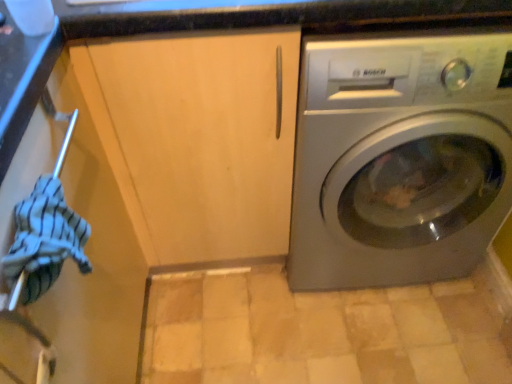
Question: Can you confirm if striped cotton towel at left is wider than satin silver washing machine at right?

Choices:
 (A) no
 (B) yes

Answer: (A)

Question: From a real-world perspective, is striped cotton towel at left on satin silver washing machine at right?

Choices:
 (A) yes
 (B) no

Answer: (A)

Question: Can you confirm if striped cotton towel at left is taller than satin silver washing machine at right?

Choices:
 (A) no
 (B) yes

Answer: (A)

Question: From the image's perspective, is striped cotton towel at left located beneath satin silver washing machine at right?

Choices:
 (A) no
 (B) yes

Answer: (B)

Question: From a real-world perspective, is striped cotton towel at left located beneath satin silver washing machine at right?

Choices:
 (A) no
 (B) yes

Answer: (A)

Question: Considering their positions, is satin silver washing machine at right located in front of or behind matte wood cabinet at center?

Choices:
 (A) behind
 (B) front

Answer: (A)

Question: Is satin silver washing machine at right wider or thinner than matte wood cabinet at center?

Choices:
 (A) wide
 (B) thin

Answer: (A)

Question: From their relative heights in the image, would you say satin silver washing machine at right is taller or shorter than matte wood cabinet at center?

Choices:
 (A) short
 (B) tall

Answer: (A)

Question: From the image's perspective, is satin silver washing machine at right positioned above or below matte wood cabinet at center?

Choices:
 (A) below
 (B) above

Answer: (B)

Question: From the image's perspective, is striped cotton towel at left above or below matte wood cabinet at center?

Choices:
 (A) above
 (B) below

Answer: (B)

Question: From a real-world perspective, relative to matte wood cabinet at center, is striped cotton towel at left vertically above or below?

Choices:
 (A) above
 (B) below

Answer: (A)

Question: Based on their sizes in the image, would you say striped cotton towel at left is bigger or smaller than matte wood cabinet at center?

Choices:
 (A) small
 (B) big

Answer: (A)

Question: In terms of width, does striped cotton towel at left look wider or thinner when compared to matte wood cabinet at center?

Choices:
 (A) thin
 (B) wide

Answer: (A)

Question: Would you say matte wood cabinet at center is to the left or to the right of satin silver washing machine at right in the picture?

Choices:
 (A) left
 (B) right

Answer: (A)

Question: From a real-world perspective, is matte wood cabinet at center physically located above or below satin silver washing machine at right?

Choices:
 (A) below
 (B) above

Answer: (B)